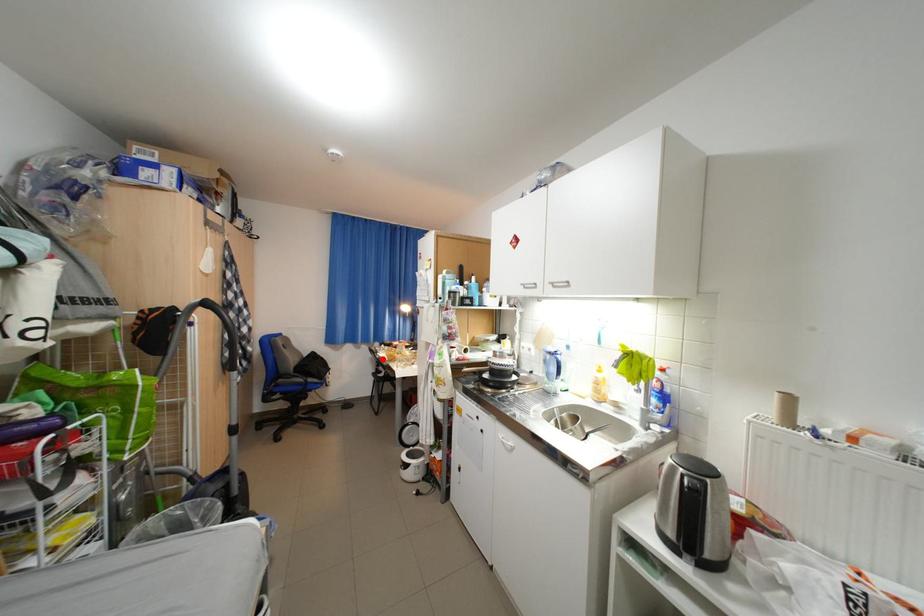
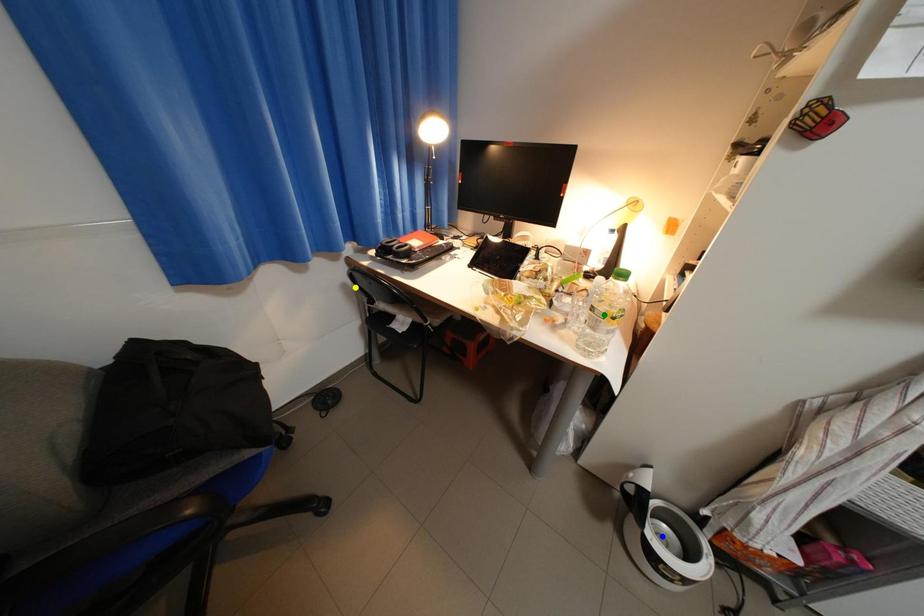
Question: I am providing you with two images of the same scene from different viewpoints. A red point is marked on the first image. You are given multiple points on the second image. Can you choose the point in image 2 that corresponds to the point in image 1?

Choices:
 (A) yellow point
 (B) blue point
 (C) green point

Answer: (A)